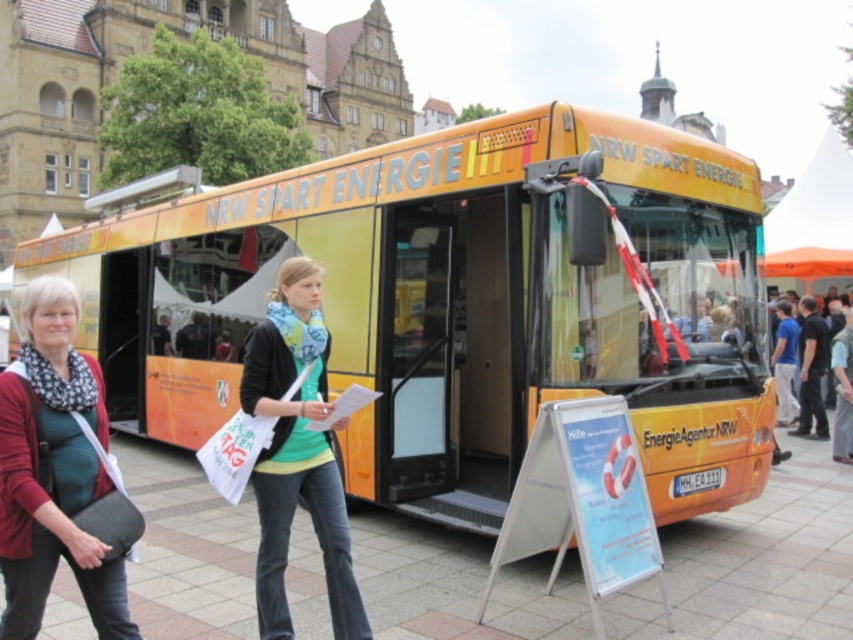
Does matte black jacket at center have a smaller size compared to white plastic sign at lower center?

No, matte black jacket at center is not smaller than white plastic sign at lower center.

Is matte black jacket at center positioned at the back of white plastic sign at lower center?

That is True.

Is point (332, 563) closer to camera compared to point (525, 456)?

Yes, it is.

Locate an element on the screen. The height and width of the screenshot is (640, 853). matte black jacket at center is located at coordinates (296, 452).

Does yellow matte bus at center appear under matte black jacket at lower left?

No.

Does point (648, 236) lie behind point (94, 394)?

Yes, it is.

The width and height of the screenshot is (853, 640). Identify the location of yellow matte bus at center. (456, 305).

Between yellow matte bus at center and white plastic sign at lower center, which one has less height?

white plastic sign at lower center is shorter.

Which is in front, point (618, 182) or point (659, 566)?

Point (659, 566) is more forward.

Where is `yellow matte bus at center`? yellow matte bus at center is located at coordinates (456, 305).